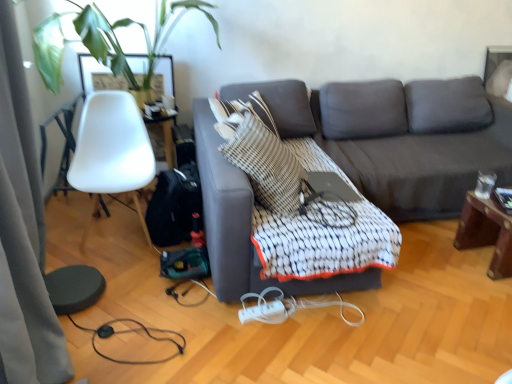
Image resolution: width=512 pixels, height=384 pixels. In order to click on vacant area that lies between white plastic extension cord at lower center and black rubber cable at lower left, the 2th cable positioned from the right in this screenshot , I will do `click(210, 331)`.